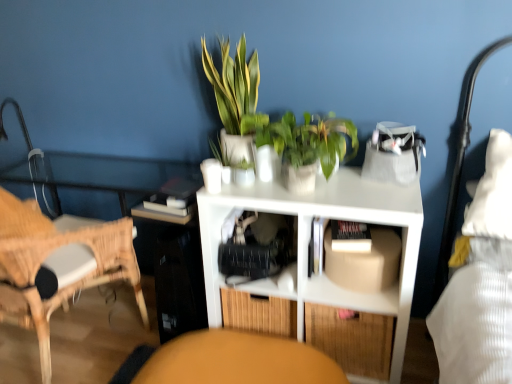
Question: Does white matte book at center have a greater height compared to bamboo drawer at lower center?

Choices:
 (A) yes
 (B) no

Answer: (B)

Question: Is white matte book at center far away from bamboo drawer at lower center?

Choices:
 (A) yes
 (B) no

Answer: (B)

Question: Is white matte book at center at the right side of bamboo drawer at lower center?

Choices:
 (A) no
 (B) yes

Answer: (A)

Question: From a real-world perspective, is white matte book at center below bamboo drawer at lower center?

Choices:
 (A) no
 (B) yes

Answer: (A)

Question: Does white matte book at center turn towards bamboo drawer at lower center?

Choices:
 (A) no
 (B) yes

Answer: (A)

Question: Relative to beige cardboard box at center, is matte orange swivel chair at lower center in front or behind?

Choices:
 (A) behind
 (B) front

Answer: (B)

Question: From a real-world perspective, relative to beige cardboard box at center, is matte orange swivel chair at lower center vertically above or below?

Choices:
 (A) below
 (B) above

Answer: (A)

Question: In terms of width, does matte orange swivel chair at lower center look wider or thinner when compared to beige cardboard box at center?

Choices:
 (A) thin
 (B) wide

Answer: (B)

Question: Is point (142, 349) closer or farther from the camera than point (375, 286)?

Choices:
 (A) farther
 (B) closer

Answer: (A)

Question: Is white matte book at center bigger or smaller than green glossy plant at center, the first houseplant in the right-to-left sequence?

Choices:
 (A) big
 (B) small

Answer: (B)

Question: Is white matte book at center wider or thinner than green glossy plant at center, the first houseplant in the right-to-left sequence?

Choices:
 (A) thin
 (B) wide

Answer: (B)

Question: In the image, is white matte book at center positioned in front of or behind green glossy plant at center, the first houseplant in the right-to-left sequence?

Choices:
 (A) front
 (B) behind

Answer: (B)

Question: Would you say white matte book at center is inside or outside green glossy plant at center, the first houseplant in the right-to-left sequence?

Choices:
 (A) inside
 (B) outside

Answer: (B)

Question: Based on their positions, is green leafy plant at upper center, the 1th houseplant in the left-to-right sequence, located to the left or right of white matte shelf at center, the 2th shelf positioned from the top?

Choices:
 (A) left
 (B) right

Answer: (A)

Question: Based on their sizes in the image, would you say green leafy plant at upper center, the 1th houseplant in the left-to-right sequence, is bigger or smaller than white matte shelf at center, positioned as the first shelf in bottom-to-top order?

Choices:
 (A) big
 (B) small

Answer: (B)